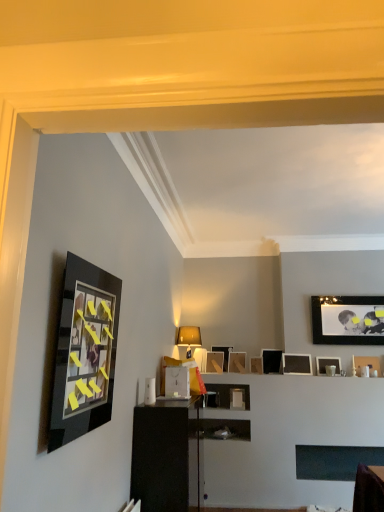
Question: Considering the relative positions of wooden picture frame at center, the 1th picture frame when ordered from back to front, and matte black picture frame at upper right, which ranks as the 7th picture frame in left-to-right order, in the image provided, is wooden picture frame at center, the 1th picture frame when ordered from back to front, to the right of matte black picture frame at upper right, which ranks as the 7th picture frame in left-to-right order, from the viewer's perspective?

Choices:
 (A) yes
 (B) no

Answer: (B)

Question: From a real-world perspective, is wooden picture frame at center, the third picture frame when ordered from left to right, located beneath matte black picture frame at upper right, the 5th picture frame when ordered from back to front?

Choices:
 (A) no
 (B) yes

Answer: (A)

Question: Is wooden picture frame at center, which is the eighth picture frame in right-to-left order, with matte black picture frame at upper right, which ranks as the fourth picture frame in right-to-left order?

Choices:
 (A) no
 (B) yes

Answer: (A)

Question: From the image's perspective, does wooden picture frame at center, the third picture frame when ordered from left to right, appear higher than matte black picture frame at upper right, the 5th picture frame when ordered from back to front?

Choices:
 (A) yes
 (B) no

Answer: (B)

Question: Does wooden picture frame at center, the third picture frame when ordered from left to right, appear on the left side of matte black picture frame at upper right, the 5th picture frame when ordered from back to front?

Choices:
 (A) yes
 (B) no

Answer: (A)

Question: Visually, is matte black picture frame at center, the fourth picture frame viewed from the left, positioned to the left or to the right of wooden picture frame at center, acting as the fifth picture frame starting from the left?

Choices:
 (A) right
 (B) left

Answer: (B)

Question: Is point (231, 352) positioned closer to the camera than point (253, 368)?

Choices:
 (A) farther
 (B) closer

Answer: (A)

Question: From the image's perspective, is matte black picture frame at center, the fourth picture frame viewed from the left, positioned above or below wooden picture frame at center, which is the third picture frame from front to back?

Choices:
 (A) above
 (B) below

Answer: (A)

Question: From a real-world perspective, is matte black picture frame at center, the fourth picture frame viewed from the left, above or below wooden picture frame at center, which appears as the 6th picture frame when viewed from the right?

Choices:
 (A) above
 (B) below

Answer: (A)

Question: Looking at the image, does wooden picture frame at center, the third picture frame when ordered from left to right, seem bigger or smaller compared to matte black picture frame at upper right, which is the 6th picture frame from back to front?

Choices:
 (A) big
 (B) small

Answer: (A)

Question: Visually, is wooden picture frame at center, which ranks as the tenth picture frame in front-to-back order, positioned to the left or to the right of matte black picture frame at upper right, which is the 6th picture frame from back to front?

Choices:
 (A) right
 (B) left

Answer: (B)

Question: Is wooden picture frame at center, which is the eighth picture frame in right-to-left order, taller or shorter than matte black picture frame at upper right, which ranks as the 5th picture frame in front-to-back order?

Choices:
 (A) tall
 (B) short

Answer: (A)

Question: Relative to matte black picture frame at upper right, which is the 6th picture frame from back to front, is wooden picture frame at center, the 1th picture frame when ordered from back to front, in front or behind?

Choices:
 (A) front
 (B) behind

Answer: (B)

Question: From a real-world perspective, is wooden picture frame at center, which is the eighth picture frame in right-to-left order, physically located above or below matte white table lamp at center?

Choices:
 (A) above
 (B) below

Answer: (B)

Question: Based on their sizes in the image, would you say wooden picture frame at center, which ranks as the tenth picture frame in front-to-back order, is bigger or smaller than matte white table lamp at center?

Choices:
 (A) big
 (B) small

Answer: (B)